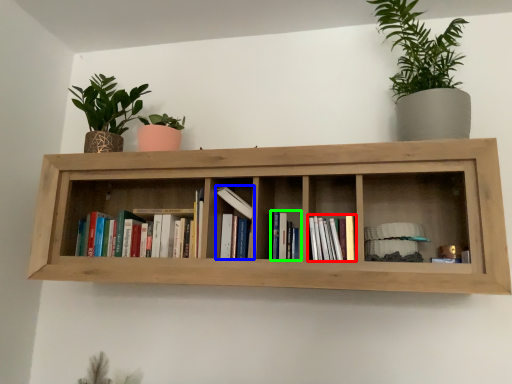
Question: Estimate the real-world distances between objects in this image. Which object is closer to book (highlighted by a red box), book (highlighted by a blue box) or book (highlighted by a green box)?

Choices:
 (A) book
 (B) book

Answer: (B)